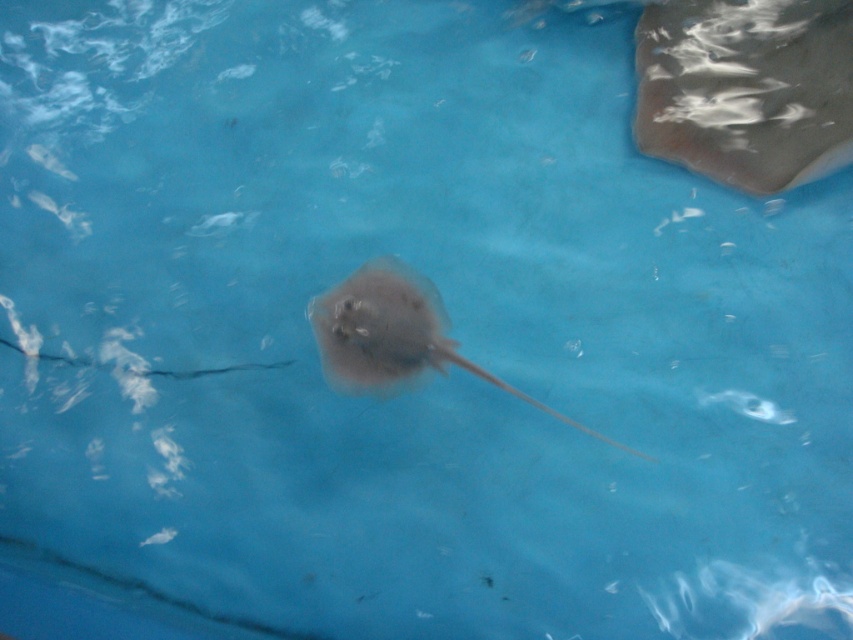
From the picture: Can you confirm if translucent rubber stingray at upper right is positioned to the left of smooth gray stingray at center?

Incorrect, translucent rubber stingray at upper right is not on the left side of smooth gray stingray at center.

Can you confirm if translucent rubber stingray at upper right is positioned below smooth gray stingray at center?

Actually, translucent rubber stingray at upper right is above smooth gray stingray at center.

Find the location of a particular element. translucent rubber stingray at upper right is located at coordinates (746, 88).